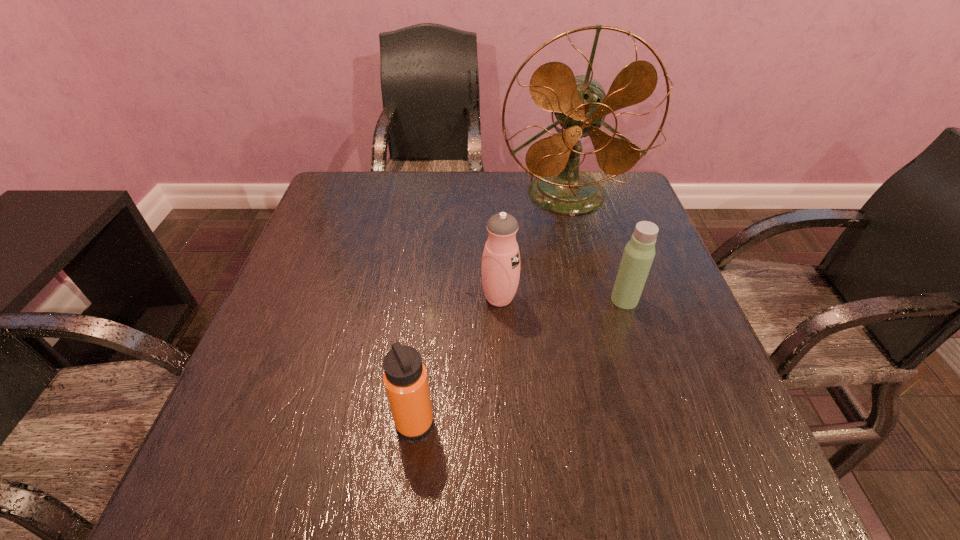
Where is `vacant space that is in between the second thermos bottle from right to left and the leftmost object`? This screenshot has width=960, height=540. vacant space that is in between the second thermos bottle from right to left and the leftmost object is located at coordinates (457, 360).

Locate an element on the screen. Image resolution: width=960 pixels, height=540 pixels. unoccupied area between the rightmost thermos bottle and the farthest object is located at coordinates (595, 247).

Identify the location of free space that is in between the second thermos bottle from left to right and the rightmost thermos bottle. (562, 299).

The width and height of the screenshot is (960, 540). I want to click on empty location between the rightmost thermos bottle and the farthest object, so click(x=595, y=247).

At what (x,y) coordinates should I click in order to perform the action: click on empty location between the rightmost thermos bottle and the leftmost object. Please return your answer as a coordinate pair (x, y). The image size is (960, 540). Looking at the image, I should click on (519, 361).

Locate an element on the screen. free spot between the rightmost thermos bottle and the second thermos bottle from right to left is located at coordinates (562, 299).

What are the coordinates of `empty space that is in between the rightmost thermos bottle and the tallest object` in the screenshot? It's located at (595, 247).

Identify the location of vacant space in between the nearest object and the fan. (491, 309).

Identify which object is the second closest to the tallest object. Please provide its 2D coordinates. Your answer should be formatted as a tuple, i.e. [(x, y)], where the tuple contains the x and y coordinates of a point satisfying the conditions above.

[(639, 252)]

Locate which object is the second closest to the leftmost object. Please provide its 2D coordinates. Your answer should be formatted as a tuple, i.e. [(x, y)], where the tuple contains the x and y coordinates of a point satisfying the conditions above.

[(639, 252)]